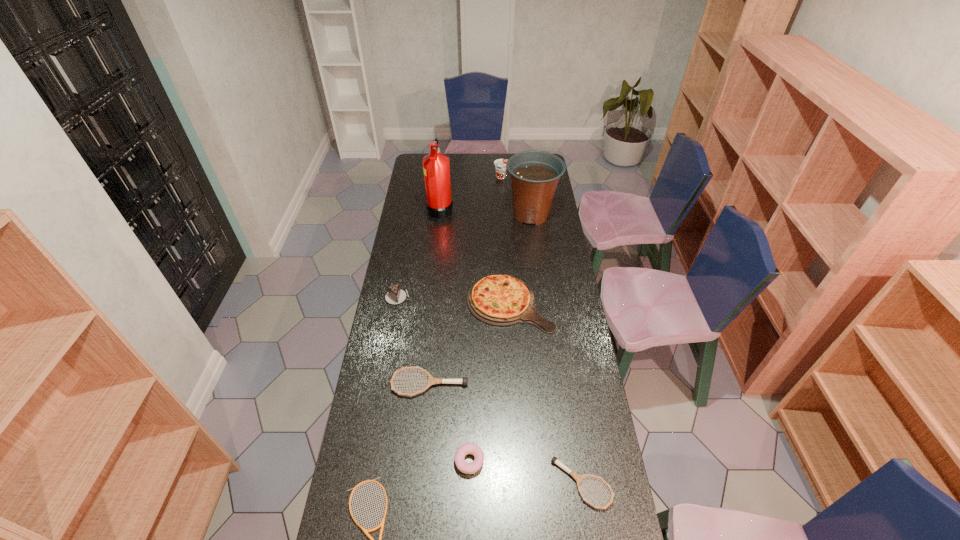
This screenshot has height=540, width=960. What are the coordinates of `vacant point that satisfies the following two spatial constraints: 1. on the front side of the right gray tennis racket; 2. on the left side of the purple doughnut` in the screenshot? It's located at (468, 483).